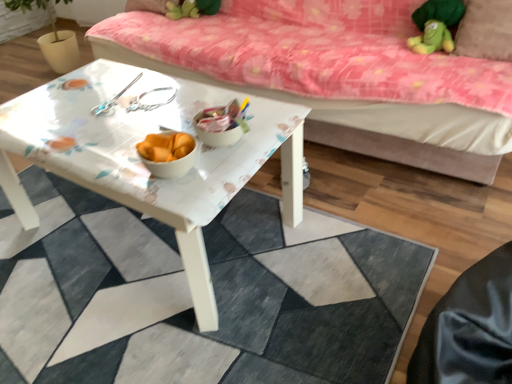
Question: Which direction should I rotate to look at pink floral fabric studio couch at upper center?

Choices:
 (A) right
 (B) left

Answer: (A)

Question: Considering the relative sizes of white glossy table at center and white glossy table at center in the image provided, is white glossy table at center taller than white glossy table at center?

Choices:
 (A) no
 (B) yes

Answer: (B)

Question: Can you confirm if white glossy table at center is bigger than white glossy table at center?

Choices:
 (A) no
 (B) yes

Answer: (B)

Question: Considering the relative sizes of white glossy table at center and white glossy table at center in the image provided, is white glossy table at center thinner than white glossy table at center?

Choices:
 (A) yes
 (B) no

Answer: (A)

Question: From the image's perspective, is white glossy table at center on top of white glossy table at center?

Choices:
 (A) yes
 (B) no

Answer: (A)

Question: From a real-world perspective, is white glossy table at center positioned under white glossy table at center based on gravity?

Choices:
 (A) no
 (B) yes

Answer: (A)

Question: Is white glossy table at center positioned beyond the bounds of white glossy table at center?

Choices:
 (A) no
 (B) yes

Answer: (B)

Question: Considering the relative positions of pink floral fabric studio couch at upper center and white glossy table at center in the image provided, is pink floral fabric studio couch at upper center to the left of white glossy table at center from the viewer's perspective?

Choices:
 (A) yes
 (B) no

Answer: (B)

Question: Considering the relative sizes of pink floral fabric studio couch at upper center and white glossy table at center in the image provided, is pink floral fabric studio couch at upper center smaller than white glossy table at center?

Choices:
 (A) yes
 (B) no

Answer: (B)

Question: Is pink floral fabric studio couch at upper center completely or partially outside of white glossy table at center?

Choices:
 (A) no
 (B) yes

Answer: (B)

Question: Is pink floral fabric studio couch at upper center closer to the viewer compared to white glossy table at center?

Choices:
 (A) no
 (B) yes

Answer: (A)

Question: Is pink floral fabric studio couch at upper center not near white glossy table at center?

Choices:
 (A) yes
 (B) no

Answer: (B)

Question: From the image's perspective, is pink floral fabric studio couch at upper center on white glossy table at center?

Choices:
 (A) yes
 (B) no

Answer: (A)

Question: Is the depth of white glossy table at center less than that of brown fabric pillow at upper right?

Choices:
 (A) yes
 (B) no

Answer: (A)